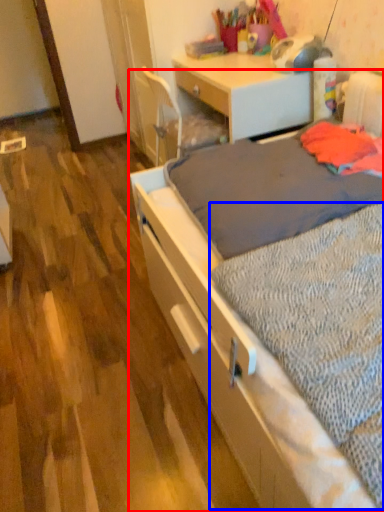
Question: Among these objects, which one is nearest to the camera, bed (highlighted by a red box) or sheet (highlighted by a blue box)?

Choices:
 (A) bed
 (B) sheet

Answer: (A)